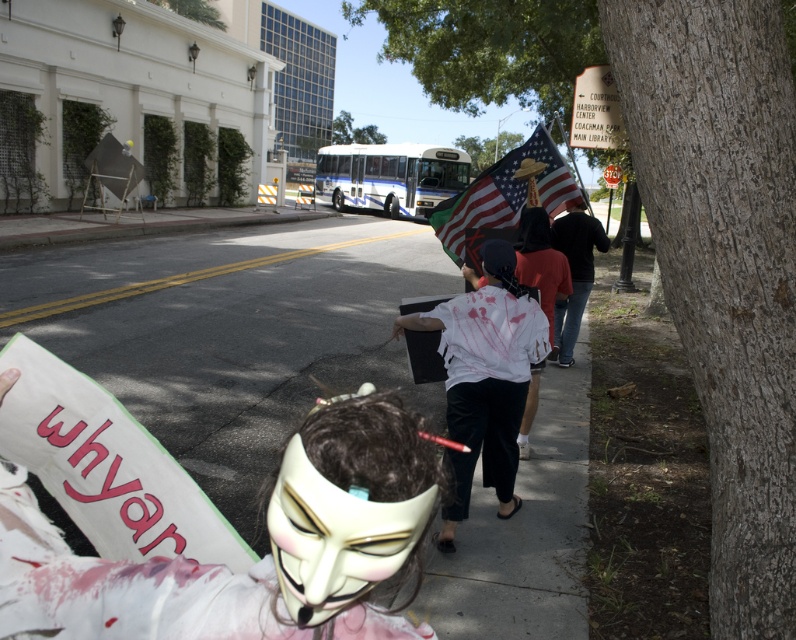
You are standing at the point with coordinates point (232, 332). What is the surface material you are standing on?

The surface material at point (232, 332) is concrete sidewalk at center.

You are a photographer trying to capture the protest scene. You want to focus on the white matte shirt at center. According to the coordinates provided, where exactly is the white matte shirt located in the image?

The white matte shirt at center is located at point [484,378].

What is the exact coordinate of the concrete sidewalk at center in the image?

The concrete sidewalk at center is located at point (232, 332).